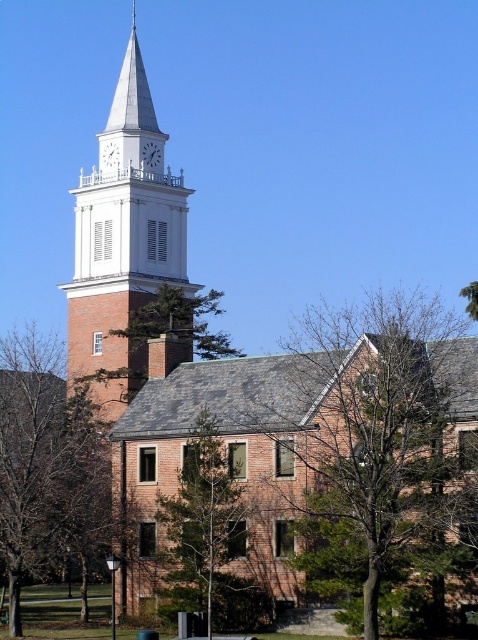
You are standing in front of the brick building and notice two trees in the scene. One is the bare branches at center, and the other is the green leafy tree at upper center. From your perspective, which tree is positioned to the right side?

The bare branches at center is to the right of the green leafy tree at upper center, so the bare branches at center is positioned to the right side.

You are standing in front of the classic brick building with a clock tower. You notice two points marked on the building. The first point is at coordinates point [205,424] and the second is at point [108,140]. Which of these two points is closer to you as you face the building?

Point [205,424] is in front of point [108,140], so it is closer to you as you face the building.

You are standing in front of the classic brick building with a clock tower. You want to take a photo of the point at coordinates point [319,547]. The camera you are using has a maximum focus range of 200 feet. Will the camera be able to focus on the point?

The distance of point [319,547] from the camera is 209.24 feet, which exceeds the camera maximum focus range of 200 feet. Therefore, the camera will not be able to focus on the point.